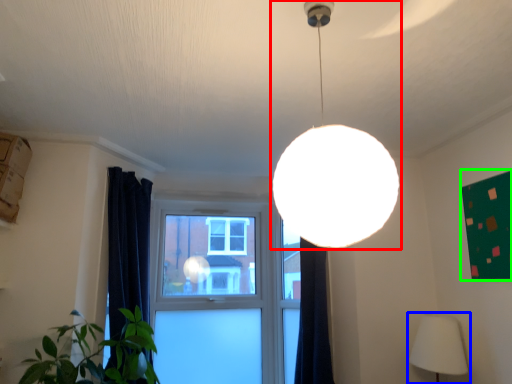
Question: Which is farther away from lamp (highlighted by a red box)? lamp (highlighted by a blue box) or bulletin board (highlighted by a green box)?

Choices:
 (A) lamp
 (B) bulletin board

Answer: (A)